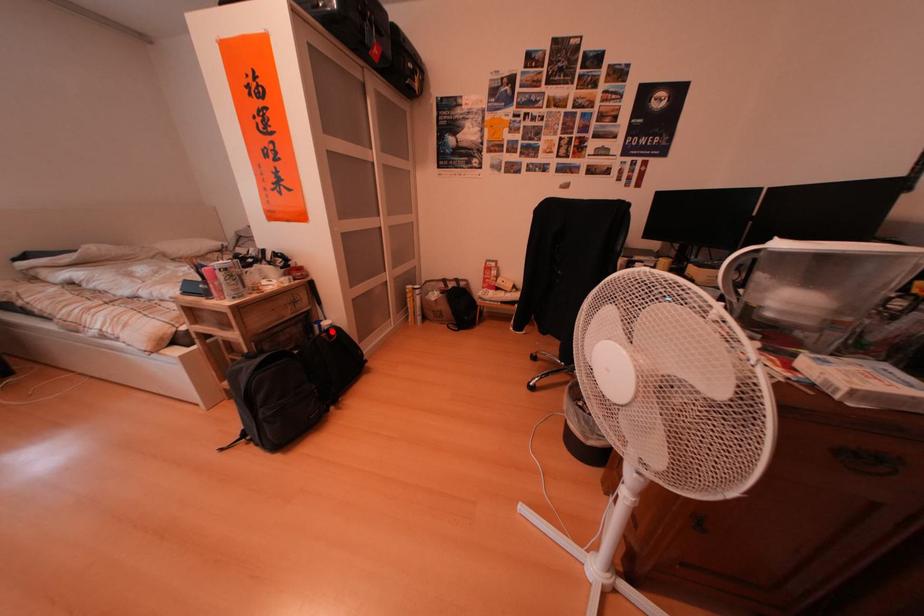
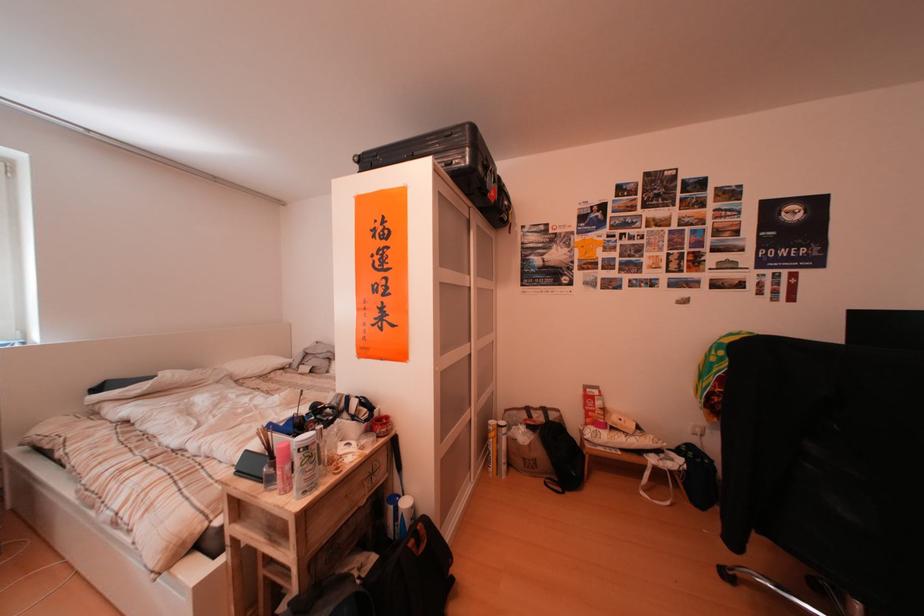
Question: I am providing you with two images of the same scene from different viewpoints. A red point is shown in image1. For the corresponding object point in image2, is it positioned nearer or farther from the camera?

Choices:
 (A) Nearer
 (B) Farther

Answer: (B)